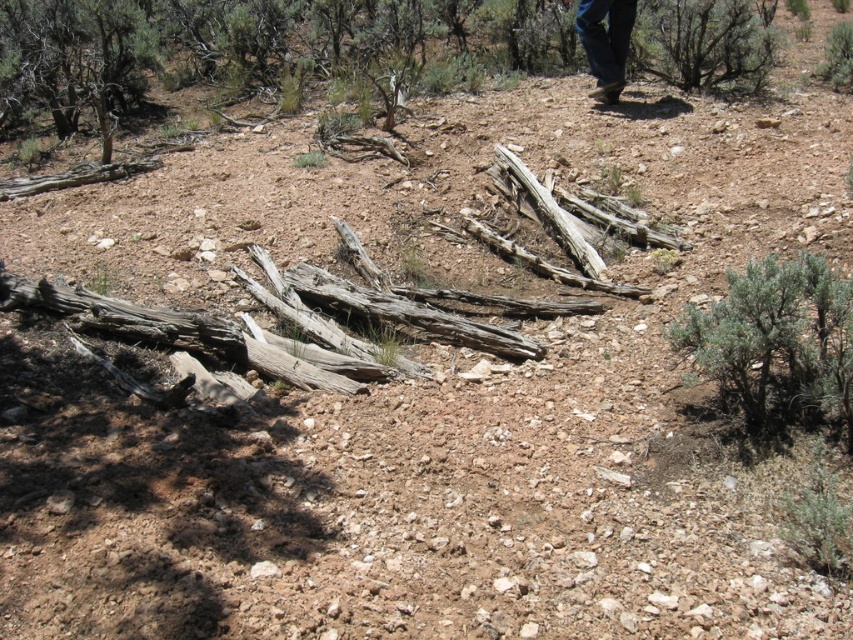
You are standing at the center of the arid landscape and want to walk towards the green leafy bush at upper right. Which direction should you move relative to the green shrub at center right?

You should move to the right of the green shrub at center right to reach the green leafy bush at upper right since the green shrub at center right is to the left of the green leafy bush at upper right.

You are standing in the arid landscape and notice the green shrub at center right and the brown suede boots at upper right. Which object is positioned lower in the scene?

The green shrub at center right is positioned lower than the brown suede boots at upper right.